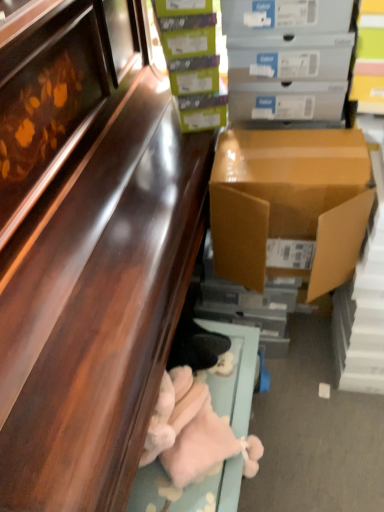
Question: Would you consider brown cardboard box at right, the first box when ordered from bottom to top, to be distant from shiny brown cabinet at lower left?

Choices:
 (A) yes
 (B) no

Answer: (B)

Question: From the image's perspective, would you say brown cardboard box at right, placed as the third box when sorted from top to bottom, is positioned over shiny brown cabinet at lower left?

Choices:
 (A) no
 (B) yes

Answer: (B)

Question: From the image's perspective, does brown cardboard box at right, the first box when ordered from bottom to top, appear lower than shiny brown cabinet at lower left?

Choices:
 (A) yes
 (B) no

Answer: (B)

Question: Is the position of brown cardboard box at right, the first box when ordered from bottom to top, less distant than that of shiny brown cabinet at lower left?

Choices:
 (A) yes
 (B) no

Answer: (B)

Question: Is brown cardboard box at right, placed as the third box when sorted from top to bottom, surrounding shiny brown cabinet at lower left?

Choices:
 (A) yes
 (B) no

Answer: (B)

Question: Can you confirm if brown cardboard box at right, the first box when ordered from bottom to top, is smaller than shiny brown cabinet at lower left?

Choices:
 (A) no
 (B) yes

Answer: (B)

Question: Is brown cardboard box at right, the first box when ordered from bottom to top, facing towards green matte box at upper center, placed as the second box when sorted from bottom to top?

Choices:
 (A) yes
 (B) no

Answer: (B)

Question: Is brown cardboard box at right, the first box when ordered from bottom to top, facing away from green matte box at upper center, arranged as the 2th box when viewed from the top?

Choices:
 (A) yes
 (B) no

Answer: (B)

Question: Is brown cardboard box at right, placed as the third box when sorted from top to bottom, taller than green matte box at upper center, arranged as the 2th box when viewed from the top?

Choices:
 (A) yes
 (B) no

Answer: (B)

Question: Is brown cardboard box at right, the first box when ordered from bottom to top, smaller than green matte box at upper center, arranged as the 2th box when viewed from the top?

Choices:
 (A) no
 (B) yes

Answer: (A)

Question: From the image's perspective, is brown cardboard box at right, placed as the third box when sorted from top to bottom, over green matte box at upper center, placed as the second box when sorted from bottom to top?

Choices:
 (A) yes
 (B) no

Answer: (B)

Question: Is brown cardboard box at right, the first box when ordered from bottom to top, positioned before green matte box at upper center, arranged as the 2th box when viewed from the top?

Choices:
 (A) no
 (B) yes

Answer: (B)

Question: From a real-world perspective, is green matte box at upper center, arranged as the 2th box when viewed from the top, under shiny brown cabinet at lower left?

Choices:
 (A) no
 (B) yes

Answer: (A)